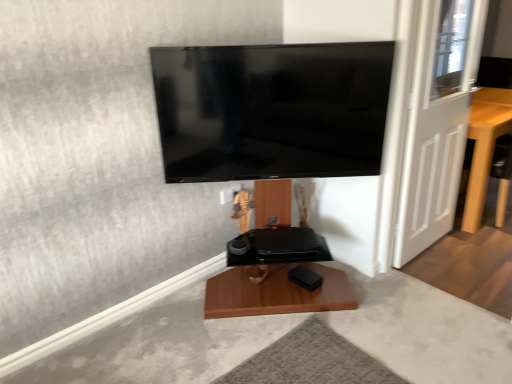
Question: Considering the relative sizes of light brown wooden table at right and white wooden door at right in the image provided, is light brown wooden table at right taller than white wooden door at right?

Choices:
 (A) no
 (B) yes

Answer: (A)

Question: From a real-world perspective, does light brown wooden table at right stand above white wooden door at right?

Choices:
 (A) no
 (B) yes

Answer: (A)

Question: Is light brown wooden table at right behind white wooden door at right?

Choices:
 (A) yes
 (B) no

Answer: (A)

Question: From a real-world perspective, is light brown wooden table at right positioned under white wooden door at right based on gravity?

Choices:
 (A) yes
 (B) no

Answer: (A)

Question: From the image's perspective, does light brown wooden table at right appear lower than white wooden door at right?

Choices:
 (A) no
 (B) yes

Answer: (B)

Question: In the image, is white wooden door at right positioned in front of or behind light brown wooden table at right?

Choices:
 (A) front
 (B) behind

Answer: (A)

Question: Looking at their shapes, would you say white wooden door at right is wider or thinner than light brown wooden table at right?

Choices:
 (A) thin
 (B) wide

Answer: (A)

Question: Looking at the image, does white wooden door at right seem bigger or smaller compared to light brown wooden table at right?

Choices:
 (A) big
 (B) small

Answer: (B)

Question: Visually, is white wooden door at right positioned to the left or to the right of light brown wooden table at right?

Choices:
 (A) right
 (B) left

Answer: (B)

Question: From the image's perspective, relative to white wooden door at right, is light brown wooden table at right above or below?

Choices:
 (A) above
 (B) below

Answer: (B)

Question: Is light brown wooden table at right taller or shorter than white wooden door at right?

Choices:
 (A) tall
 (B) short

Answer: (B)

Question: Would you say light brown wooden table at right is to the left or to the right of white wooden door at right in the picture?

Choices:
 (A) right
 (B) left

Answer: (A)

Question: In the image, is light brown wooden table at right positioned in front of or behind white wooden door at right?

Choices:
 (A) front
 (B) behind

Answer: (B)

Question: Considering the relative positions of light brown wooden table at right and flat screen tv at upper center in the image provided, is light brown wooden table at right to the left or to the right of flat screen tv at upper center?

Choices:
 (A) left
 (B) right

Answer: (B)

Question: In terms of size, does light brown wooden table at right appear bigger or smaller than flat screen tv at upper center?

Choices:
 (A) big
 (B) small

Answer: (A)